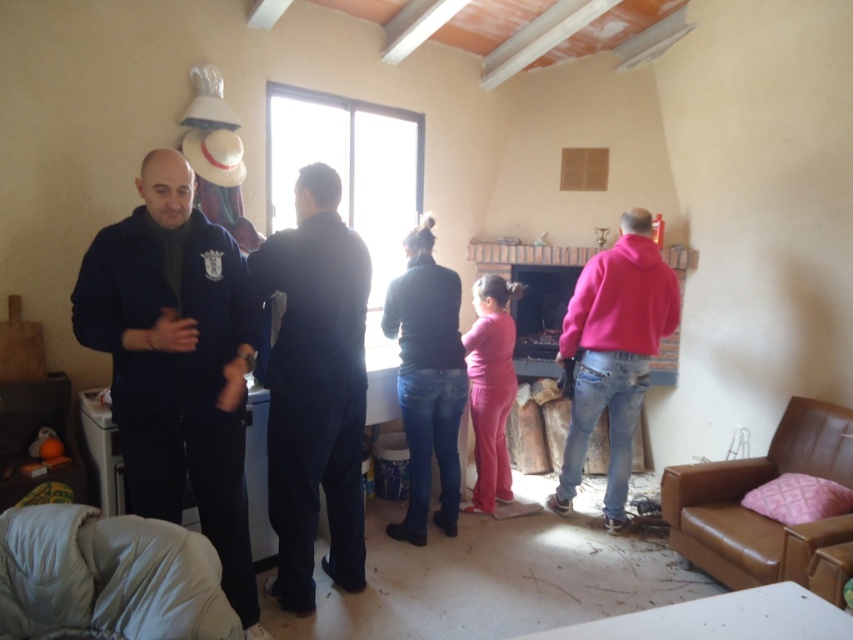
Question: Among these points, which one is farthest from the camera?

Choices:
 (A) (306, 593)
 (B) (635, 342)

Answer: (B)

Question: Which point is closer to the camera?

Choices:
 (A) (444, 490)
 (B) (630, 452)

Answer: (A)

Question: Among these points, which one is farthest from the camera?

Choices:
 (A) (288, 550)
 (B) (646, 272)

Answer: (B)

Question: Does navy blue fleece jacket at left have a smaller size compared to pink matte pants at center?

Choices:
 (A) no
 (B) yes

Answer: (A)

Question: Does navy blue fleece jacket at left have a lesser width compared to pink fleece jacket at right?

Choices:
 (A) no
 (B) yes

Answer: (B)

Question: Is navy blue fleece jacket at left further to the viewer compared to dark blue sweater at center?

Choices:
 (A) yes
 (B) no

Answer: (B)